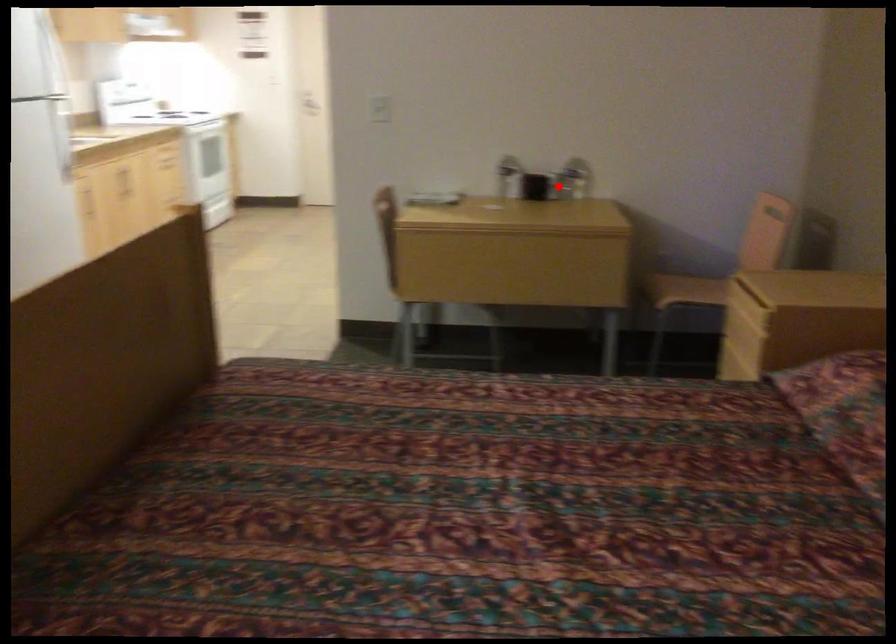
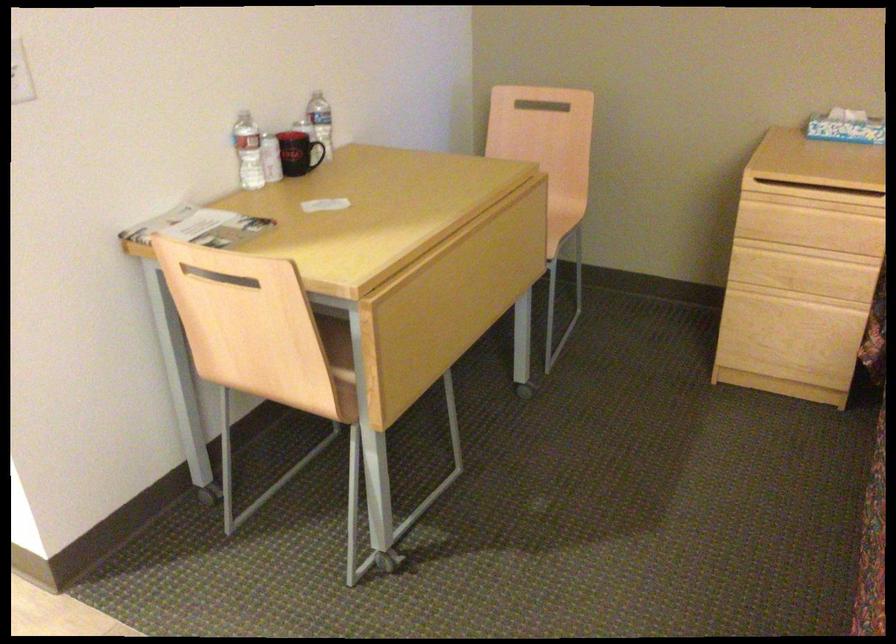
Question: I am providing you with two images of the same scene from different viewpoints. A red point is shown in image1. For the corresponding object point in image2, is it positioned nearer or farther from the camera?

Choices:
 (A) Nearer
 (B) Farther

Answer: (A)